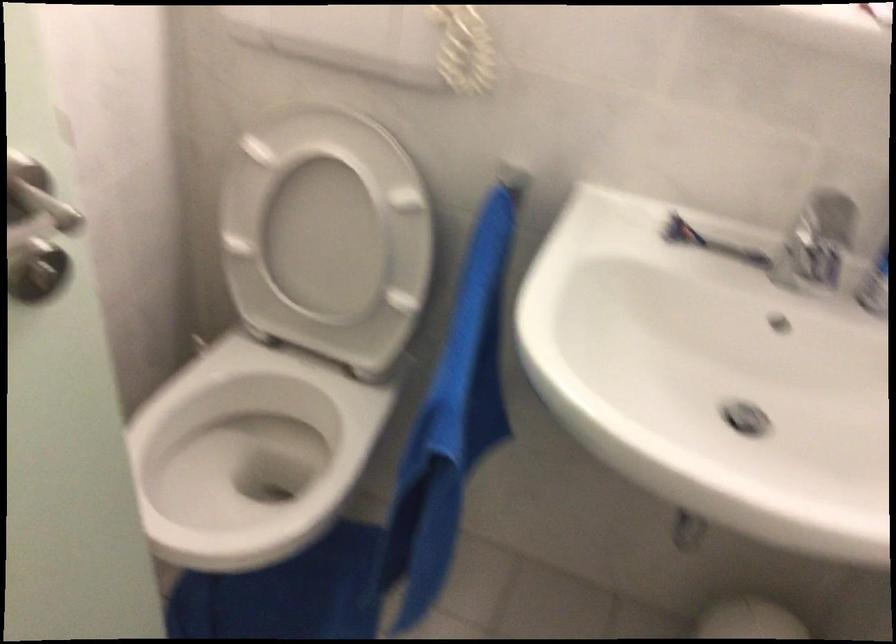
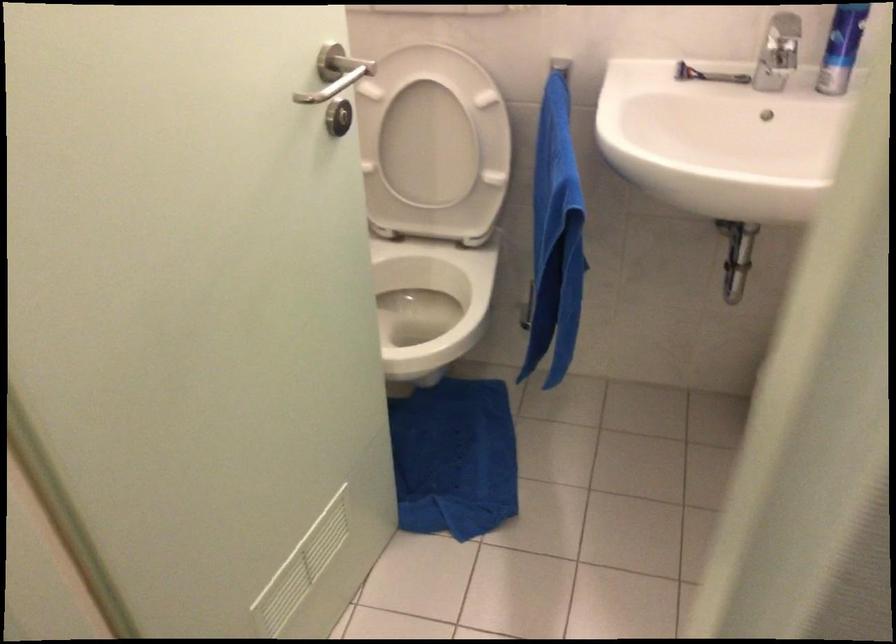
Where in the second image is the point corresponding to (426,459) from the first image?

(555, 238)